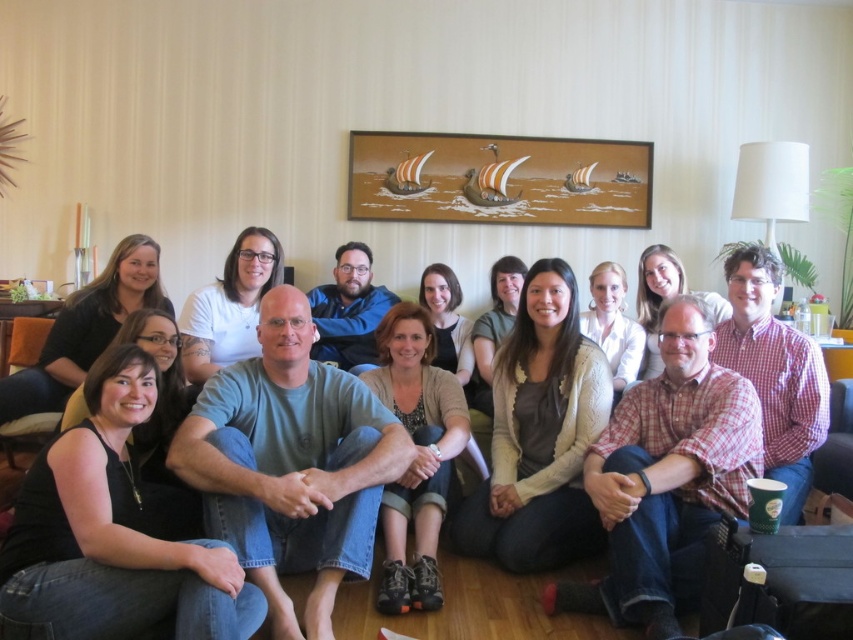
Between green cotton shirt at center and matte gray shirt at center, which one appears on the left side from the viewer's perspective?

green cotton shirt at center is more to the left.

Consider the image. Does green cotton shirt at center appear on the right side of matte gray shirt at center?

No, green cotton shirt at center is not to the right of matte gray shirt at center.

Is point (286, 372) positioned after point (811, 634)?

Yes, point (286, 372) is farther from viewer.

Locate an element on the screen. Image resolution: width=853 pixels, height=640 pixels. green cotton shirt at center is located at coordinates (291, 465).